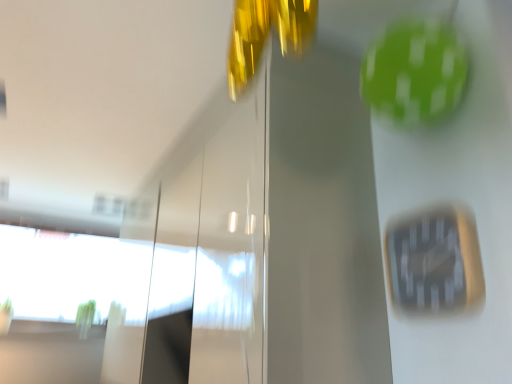
Question: Is black plastic clock at center-right turned away from transparent glass window at lower left?

Choices:
 (A) no
 (B) yes

Answer: (A)

Question: Considering the relative sizes of black plastic clock at center-right and transparent glass window at lower left in the image provided, is black plastic clock at center-right thinner than transparent glass window at lower left?

Choices:
 (A) no
 (B) yes

Answer: (B)

Question: Is black plastic clock at center-right further to camera compared to transparent glass window at lower left?

Choices:
 (A) yes
 (B) no

Answer: (B)

Question: Considering the relative sizes of black plastic clock at center-right and transparent glass window at lower left in the image provided, is black plastic clock at center-right wider than transparent glass window at lower left?

Choices:
 (A) yes
 (B) no

Answer: (B)

Question: Is black plastic clock at center-right facing towards transparent glass window at lower left?

Choices:
 (A) no
 (B) yes

Answer: (A)

Question: Is black plastic clock at center-right completely or partially outside of transparent glass window at lower left?

Choices:
 (A) yes
 (B) no

Answer: (A)

Question: Considering the relative sizes of transparent glass window at lower left and black plastic clock at center-right in the image provided, is transparent glass window at lower left shorter than black plastic clock at center-right?

Choices:
 (A) no
 (B) yes

Answer: (A)

Question: From the image's perspective, does transparent glass window at lower left appear higher than black plastic clock at center-right?

Choices:
 (A) yes
 (B) no

Answer: (B)

Question: Considering the relative sizes of transparent glass window at lower left and black plastic clock at center-right in the image provided, is transparent glass window at lower left smaller than black plastic clock at center-right?

Choices:
 (A) no
 (B) yes

Answer: (A)

Question: Could you tell me if transparent glass window at lower left is turned towards black plastic clock at center-right?

Choices:
 (A) yes
 (B) no

Answer: (A)

Question: Is transparent glass window at lower left far from black plastic clock at center-right?

Choices:
 (A) yes
 (B) no

Answer: (A)

Question: Does transparent glass window at lower left have a larger size compared to black plastic clock at center-right?

Choices:
 (A) no
 (B) yes

Answer: (B)

Question: Is point (413, 261) positioned closer to the camera than point (100, 271)?

Choices:
 (A) closer
 (B) farther

Answer: (A)